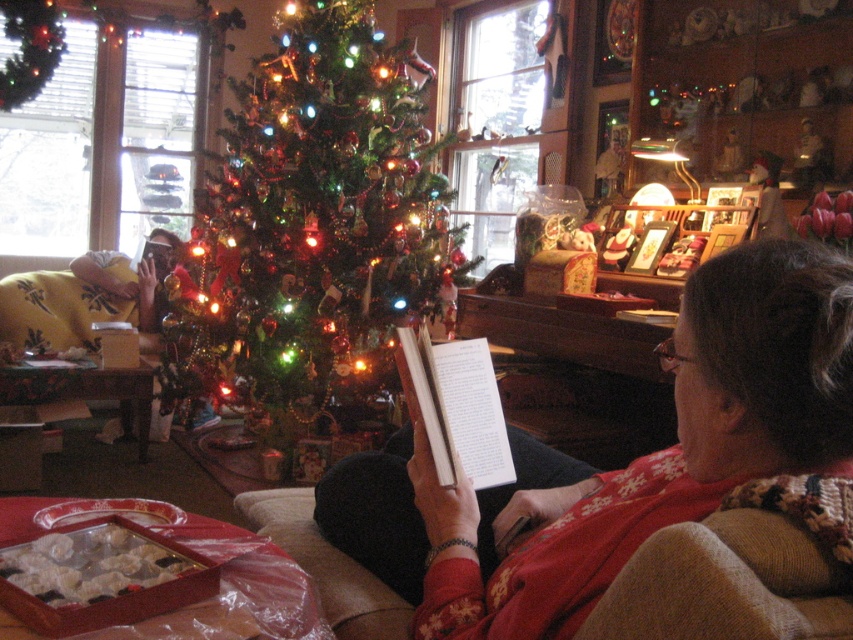
Does shiny green christmas tree at center have a lesser height compared to white paper book at center?

In fact, shiny green christmas tree at center may be taller than white paper book at center.

Who is positioned more to the left, shiny green christmas tree at center or white paper book at center?

From the viewer's perspective, shiny green christmas tree at center appears more on the left side.

Which is in front, point (248, 364) or point (428, 348)?

Point (428, 348)

The image size is (853, 640). Identify the location of shiny green christmas tree at center. (323, 209).

The height and width of the screenshot is (640, 853). In order to click on red sweater at center in this screenshot , I will do `click(639, 458)`.

Between point (738, 420) and point (355, 88), which one is positioned in front?

Point (738, 420)

In order to click on red sweater at center in this screenshot , I will do `click(639, 458)`.

Find the location of a particular element. Image resolution: width=853 pixels, height=640 pixels. red sweater at center is located at coordinates (639, 458).

Which is behind, point (447, 630) or point (459, 356)?

The point (459, 356) is more distant.

Does red sweater at center appear over white paper book at center?

Actually, red sweater at center is below white paper book at center.

Between point (728, 461) and point (497, 401), which one is positioned behind?

Point (497, 401)

Image resolution: width=853 pixels, height=640 pixels. I want to click on red sweater at center, so click(639, 458).